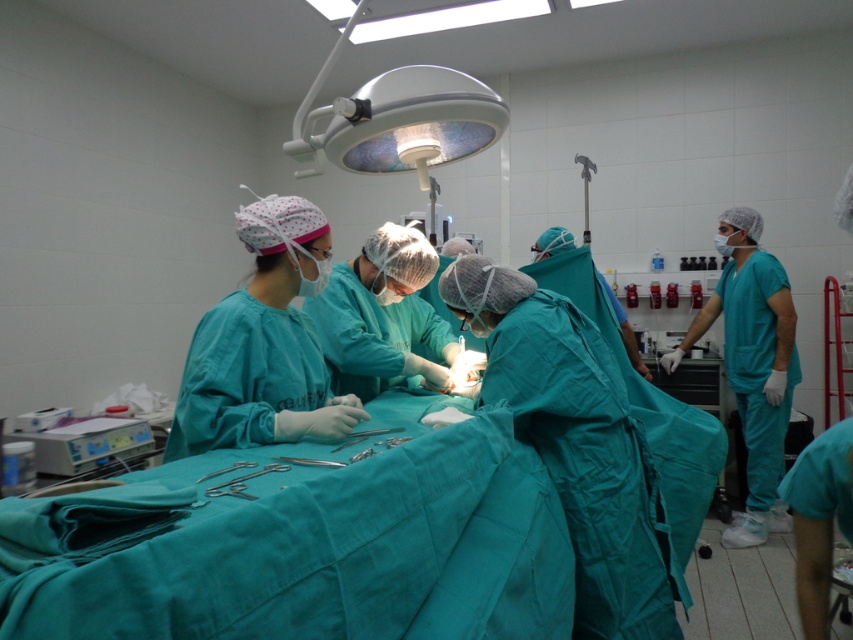
Question: Among these points, which one is farthest from the camera?

Choices:
 (A) (271, 468)
 (B) (410, 259)

Answer: (B)

Question: Is metallic silver medical device at lower left closer to the viewer compared to metallic silver scissors at center?

Choices:
 (A) no
 (B) yes

Answer: (A)

Question: Observing the image, what is the correct spatial positioning of teal matte scrubs at right in reference to metallic silver medical device at lower left?

Choices:
 (A) right
 (B) left

Answer: (A)

Question: Which point is farther to the camera?

Choices:
 (A) pyautogui.click(x=71, y=429)
 (B) pyautogui.click(x=230, y=492)
 (C) pyautogui.click(x=427, y=360)

Answer: (A)

Question: Which object is closer to the camera taking this photo?

Choices:
 (A) metallic silver medical device at lower left
 (B) metallic silver scissors at center
 (C) matte green gown at center

Answer: (B)

Question: Is metallic silver medical device at lower left positioned before metallic silver scissors at center?

Choices:
 (A) no
 (B) yes

Answer: (A)